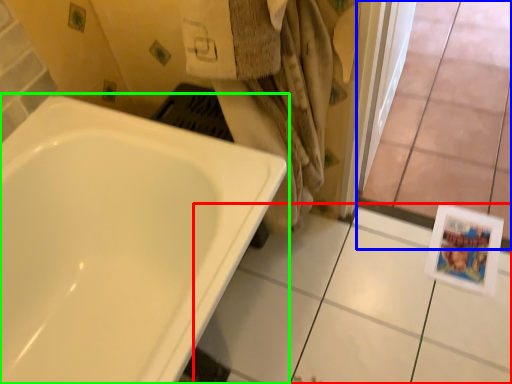
Question: Estimate the real-world distances between objects in this image. Which object is farther from ceramic tile (highlighted by a red box), glass door (highlighted by a blue box) or bathtub (highlighted by a green box)?

Choices:
 (A) glass door
 (B) bathtub

Answer: (B)